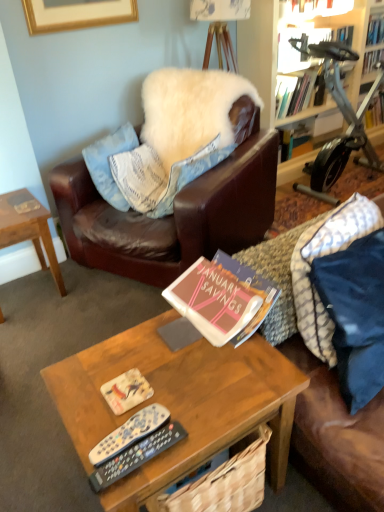
The height and width of the screenshot is (512, 384). I want to click on free space to the back side of black plastic remote at center, which is the second remote control from back to front, so tap(148, 387).